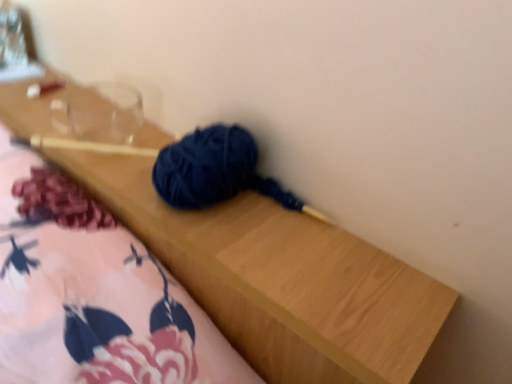
Question: Does fluffy pink blanket at lower left have a greater height compared to transparent glass at upper left?

Choices:
 (A) yes
 (B) no

Answer: (A)

Question: Is fluffy pink blanket at lower left thinner than transparent glass at upper left?

Choices:
 (A) no
 (B) yes

Answer: (A)

Question: Could transparent glass at upper left be considered to be inside fluffy pink blanket at lower left?

Choices:
 (A) no
 (B) yes

Answer: (A)

Question: Is fluffy pink blanket at lower left far from transparent glass at upper left?

Choices:
 (A) yes
 (B) no

Answer: (B)

Question: Is fluffy pink blanket at lower left facing towards transparent glass at upper left?

Choices:
 (A) yes
 (B) no

Answer: (B)

Question: Considering the relative positions of fluffy pink blanket at lower left and transparent glass at upper left in the image provided, is fluffy pink blanket at lower left to the right of transparent glass at upper left from the viewer's perspective?

Choices:
 (A) yes
 (B) no

Answer: (A)

Question: Would you say transparent glass jar at upper left is part of fluffy pink blanket at lower left's contents?

Choices:
 (A) no
 (B) yes

Answer: (A)

Question: Is fluffy pink blanket at lower left at the left side of transparent glass jar at upper left?

Choices:
 (A) yes
 (B) no

Answer: (B)

Question: From a real-world perspective, is fluffy pink blanket at lower left below transparent glass jar at upper left?

Choices:
 (A) yes
 (B) no

Answer: (A)

Question: Does fluffy pink blanket at lower left have a greater width compared to transparent glass jar at upper left?

Choices:
 (A) yes
 (B) no

Answer: (A)

Question: From the image's perspective, would you say fluffy pink blanket at lower left is shown under transparent glass jar at upper left?

Choices:
 (A) yes
 (B) no

Answer: (A)

Question: Is fluffy pink blanket at lower left at the right side of transparent glass jar at upper left?

Choices:
 (A) yes
 (B) no

Answer: (A)

Question: Can you confirm if transparent glass jar at upper left is positioned to the left of fluffy pink blanket at lower left?

Choices:
 (A) yes
 (B) no

Answer: (A)